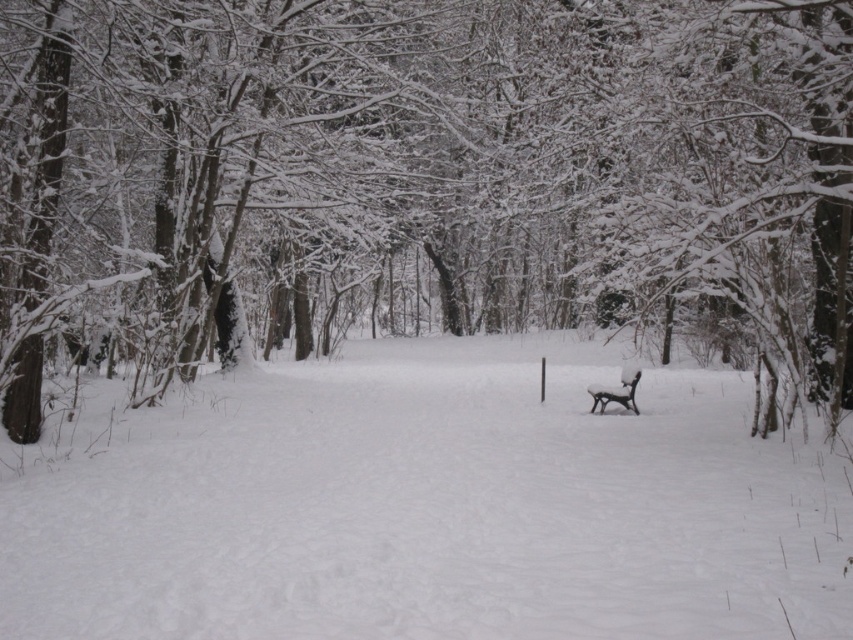
Based on the photo, you are standing at the point marked as point [424,172] in the winter forest scene. Which object from the scene are you currently standing on?

You are standing on the snow covered tree at center.